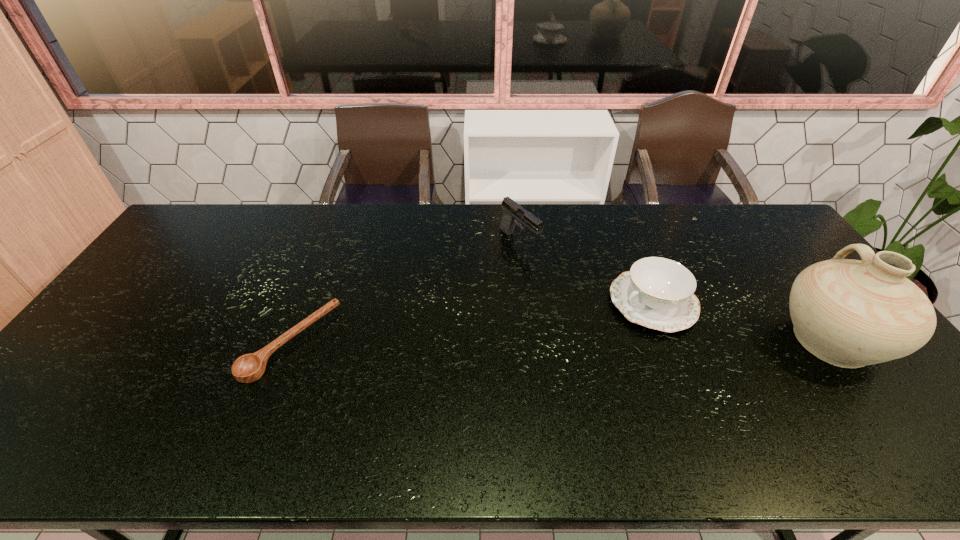
Locate an element on the screen. free space located on the handle side of the second object from right to left is located at coordinates (591, 335).

You are a GUI agent. You are given a task and a screenshot of the screen. Output one action in this format:
    pyautogui.click(x=<x>, y=<y>)
    Task: Click on the vacant point located 0.240m on the handle side of the second object from right to left
    
    Given the screenshot: What is the action you would take?
    pyautogui.click(x=554, y=355)

What are the coordinates of `free space located 0.070m on the handle side of the second object from right to left` in the screenshot? It's located at (603, 329).

Find the location of a particular element. The height and width of the screenshot is (540, 960). vacant space located aim along the barrel of the second object from left to right is located at coordinates (588, 300).

Where is `vacant space positioned 0.350m aim along the barrel of the second object from left to right`? vacant space positioned 0.350m aim along the barrel of the second object from left to right is located at coordinates (612, 319).

I want to click on vacant space located 0.190m aim along the barrel of the second object from left to right, so click(x=572, y=287).

This screenshot has width=960, height=540. I want to click on object that is at the far edge, so tap(512, 210).

The image size is (960, 540). Find the location of `wooden spoon located in the near edge section of the desktop`. wooden spoon located in the near edge section of the desktop is located at coordinates (248, 368).

Identify the location of pottery present at the near edge. (849, 313).

Where is `object at the right edge`? The image size is (960, 540). object at the right edge is located at coordinates (849, 313).